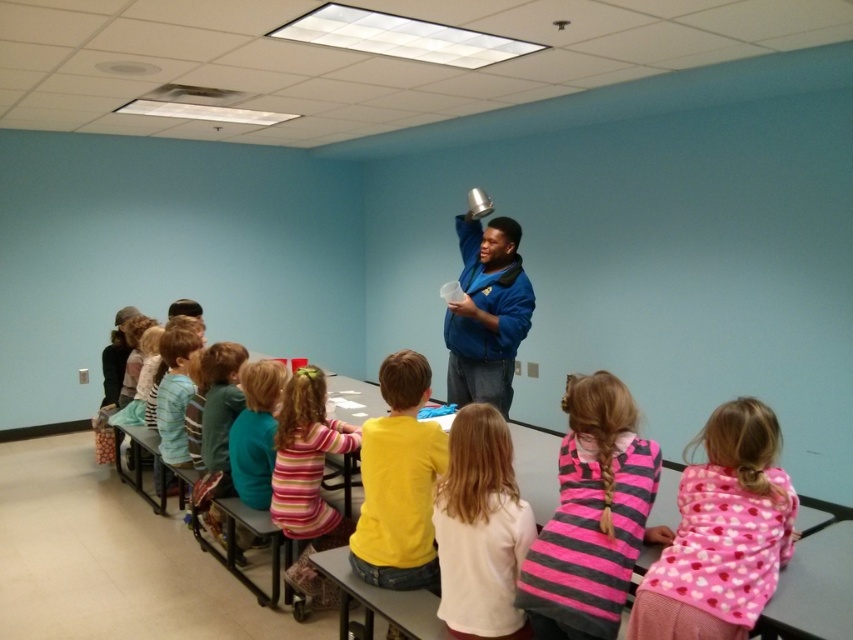
You are a teacher in the classroom. You need to place a 30 cm wide science kit between the pink striped sweater at center and the blue fleece jacket at center. Is there enough space between them to fit the science kit?

The pink striped sweater at center is wider than the blue fleece jacket at center, so the space between them might be sufficient to fit the 30 cm wide science kit. However, the exact width isn not specified, so it depends on their actual positions.

In the scene shown: You are a student sitting at the table in the classroom. You notice two points marked on the wall in front of you. The first point is at coordinates point (572, 477) and the second point is at point (462, 246). Which point is closer to you?

Point (572, 477) is closer to the viewer than point (462, 246).